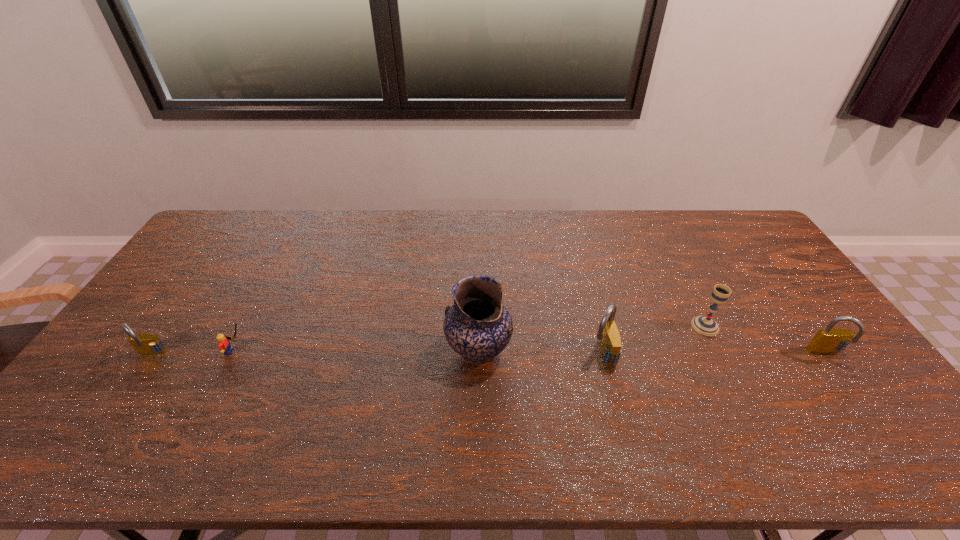
In order to click on vacant space located 0.070m on the side with the combination dials of the leftmost padlock in this screenshot , I will do pos(132,384).

This screenshot has width=960, height=540. Find the location of `free spot located 0.270m on the side with the combination dials of the second padlock from right to left`. free spot located 0.270m on the side with the combination dials of the second padlock from right to left is located at coordinates (492, 354).

You are a GUI agent. You are given a task and a screenshot of the screen. Output one action in this format:
    pyautogui.click(x=<x>, y=<y>)
    Task: Click on the free space located on the side with the combination dials of the second padlock from right to left
    
    Given the screenshot: What is the action you would take?
    pyautogui.click(x=553, y=354)

This screenshot has width=960, height=540. What are the coordinates of `free spot located 0.300m on the side with the combination dials of the second padlock from right to left` in the screenshot? It's located at (481, 354).

What are the coordinates of `free point located 0.120m on the side with the combination dials of the second shortest padlock` in the screenshot? It's located at (861, 401).

Identify the location of free space located on the back of the second object from right to left. (666, 248).

I want to click on vacant space located 0.400m on the front-facing side of the Lego, so click(x=391, y=352).

Find the location of a particular element. This screenshot has width=960, height=540. free location located on the right of the third object from left to right is located at coordinates (580, 351).

Where is `object located in the left edge section of the desktop`? object located in the left edge section of the desktop is located at coordinates (146, 344).

Find the location of a particular element. object situated at the right edge is located at coordinates (830, 340).